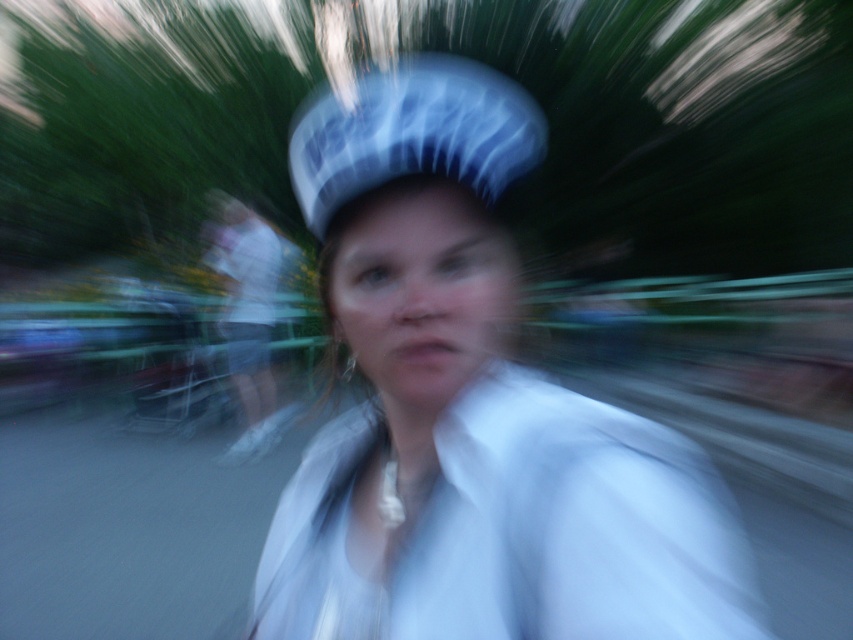
Question: Which of the following is the farthest from the observer?

Choices:
 (A) (285, 586)
 (B) (271, 314)
 (C) (595, 564)
 (D) (338, 172)

Answer: (B)

Question: Is the position of white silky dress shirt at center more distant than that of white fabric shirt at center?

Choices:
 (A) yes
 (B) no

Answer: (B)

Question: Does white silky dress shirt at center appear over white striped bicycle helmet at center?

Choices:
 (A) no
 (B) yes

Answer: (A)

Question: Is white silky dress shirt at center wider than white fabric shirt at center?

Choices:
 (A) no
 (B) yes

Answer: (A)

Question: Which object is closer to the camera taking this photo?

Choices:
 (A) white fabric at center
 (B) white silky dress shirt at center
 (C) white fabric shirt at center

Answer: (B)

Question: Which point is farther from the camera taking this photo?

Choices:
 (A) [486, 554]
 (B) [498, 86]
 (C) [271, 276]
 (D) [695, 513]

Answer: (C)